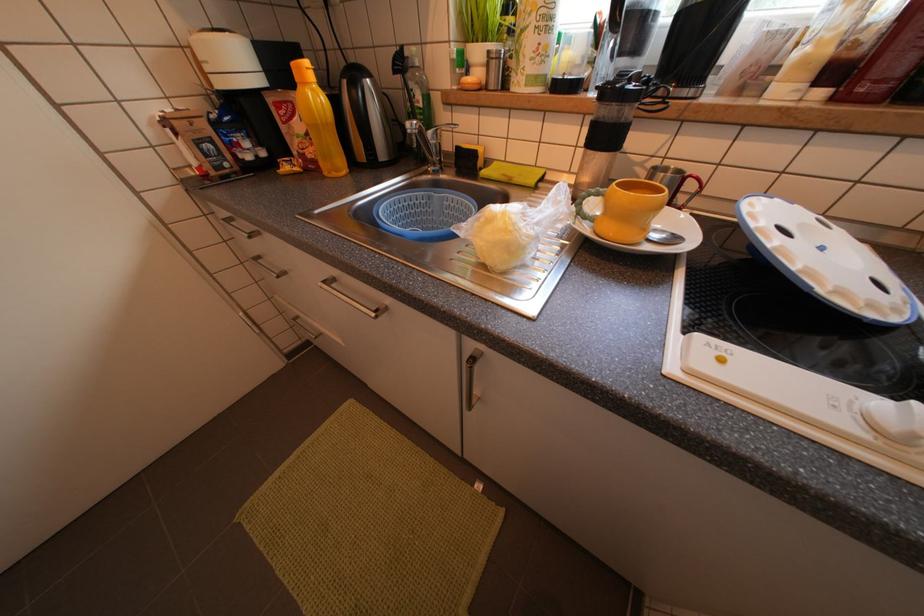
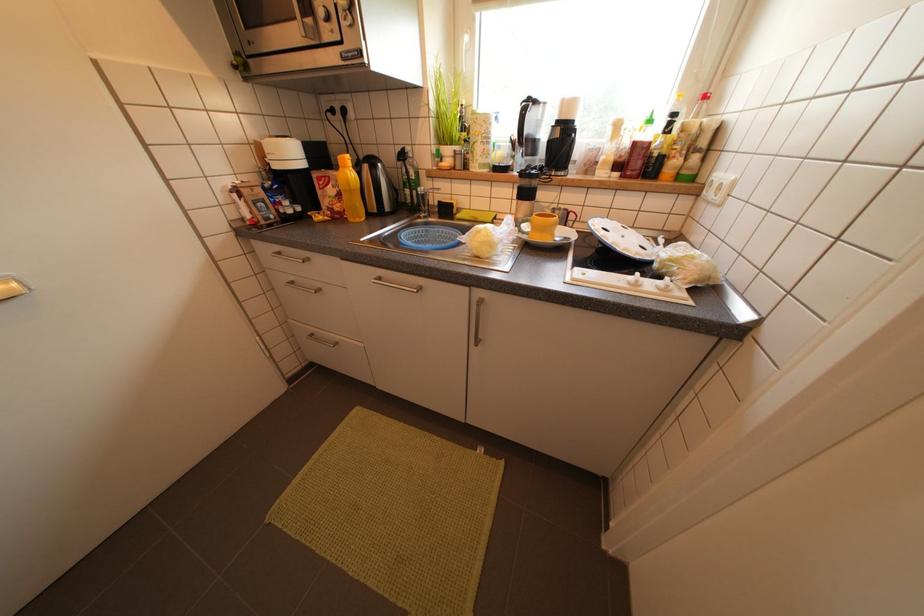
Question: How did the camera likely rotate?

Choices:
 (A) Left
 (B) Right
 (C) Up
 (D) Down

Answer: (B)